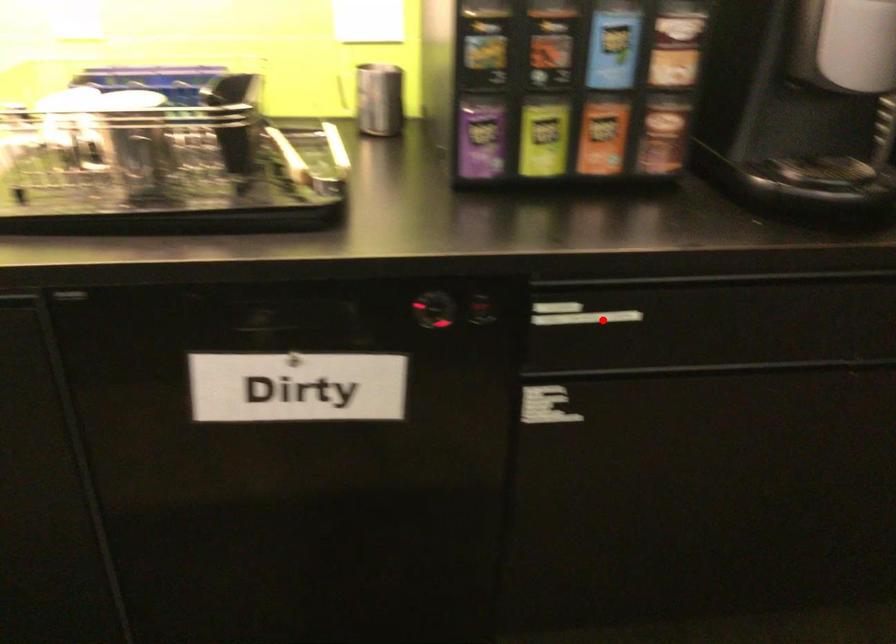
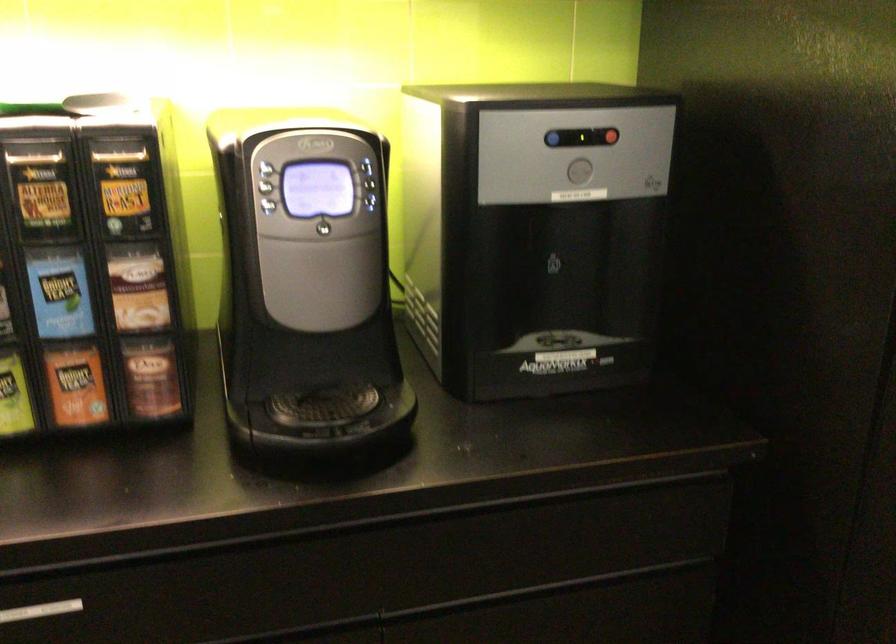
Locate, in the second image, the point that corresponds to the highlighted location in the first image.

(40, 611)